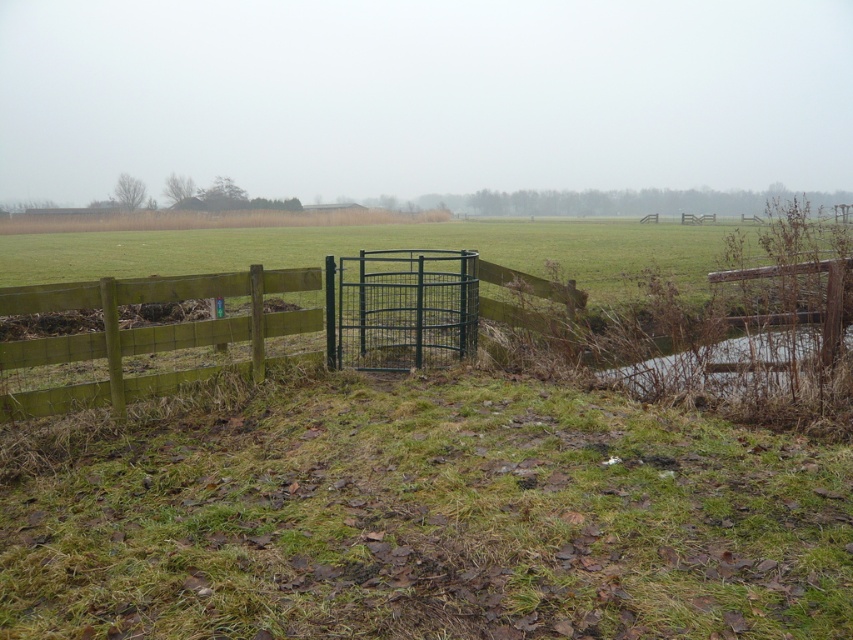
In the scene shown: You are a farmer checking the boundaries of your property. You notice the green wooden fence at left and the green wire cage at center. Which structure is shorter in height?

The green wooden fence at left is shorter in height compared to the green wire cage at center.

You are standing in the rural landscape and want to walk from the point closer to you to the point further away. Which path would you take between the two points, point (253,291) and point (376,298)?

The path from point (253,291) to point (376,298) would involve moving forward and slightly to the right, as point (376,298) is further away from the viewer compared to point (253,291).

You are a farmer checking your property. You see the green wooden fence at left and the green wire cage at center. Which object is nearer to you?

The green wooden fence at left is closer to the viewer than the green wire cage at center.